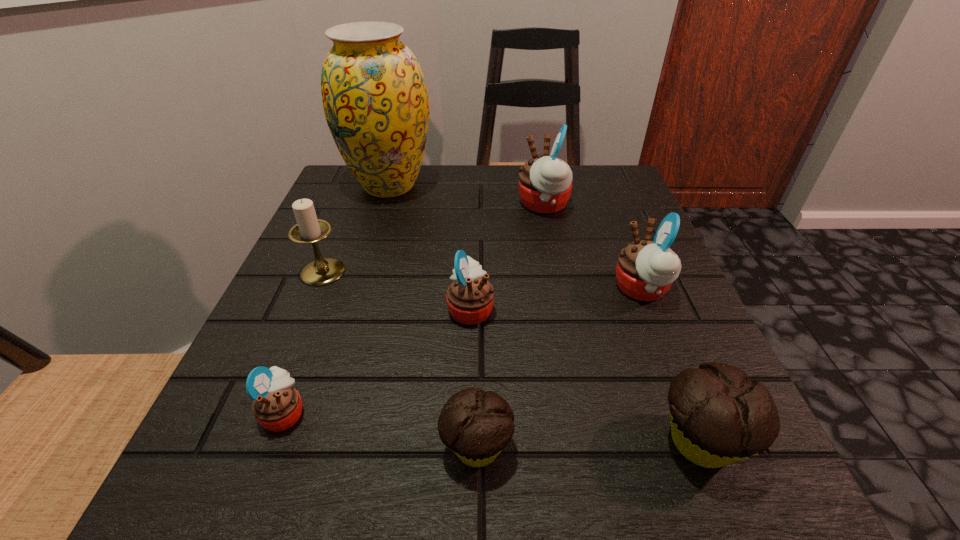
This screenshot has width=960, height=540. I want to click on object situated at the far right corner, so click(x=545, y=183).

The image size is (960, 540). I want to click on object that is at the near right corner, so click(718, 416).

Image resolution: width=960 pixels, height=540 pixels. I want to click on vacant space at the far edge of the desktop, so click(x=420, y=206).

At what (x,y) coordinates should I click in order to perform the action: click on vacant area at the near edge. Please return your answer as a coordinate pair (x, y). This screenshot has height=540, width=960. Looking at the image, I should click on (564, 472).

Locate an element on the screen. Image resolution: width=960 pixels, height=540 pixels. free space at the left edge of the desktop is located at coordinates (366, 226).

Where is `free point at the far left corner`? This screenshot has height=540, width=960. free point at the far left corner is located at coordinates (373, 198).

I want to click on free space at the near left corner of the desktop, so click(x=218, y=484).

At what (x,y) coordinates should I click in order to perform the action: click on free space at the far right corner of the desktop. Please return your answer as a coordinate pair (x, y). This screenshot has width=960, height=540. Looking at the image, I should click on (588, 185).

You are a GUI agent. You are given a task and a screenshot of the screen. Output one action in this format:
    pyautogui.click(x=<x>, y=<y>)
    Task: Click on the vacant point located between the rightmost pink muffin and the smallest pink muffin
    The width and height of the screenshot is (960, 540).
    Given the screenshot: What is the action you would take?
    pyautogui.click(x=463, y=350)

At what (x,y) coordinates should I click in order to perform the action: click on free space that is in between the farthest pink muffin and the white candle holder. Please return your answer as a coordinate pair (x, y). The height and width of the screenshot is (540, 960). Looking at the image, I should click on (433, 238).